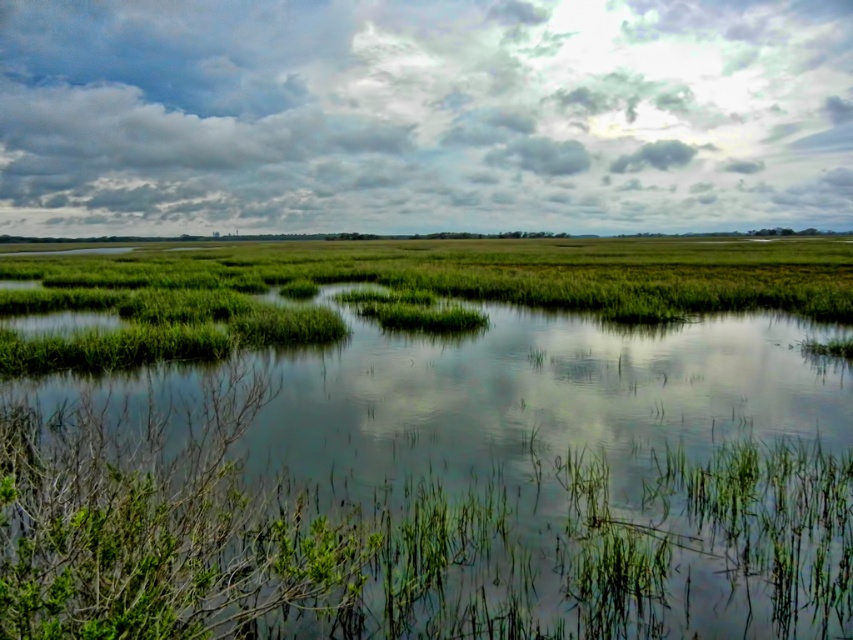
Is point (843, 22) closer to viewer compared to point (370, 502)?

No.

This screenshot has height=640, width=853. What do you see at coordinates (422, 115) in the screenshot?
I see `cloudy sky at upper center` at bounding box center [422, 115].

Locate an element on the screen. The height and width of the screenshot is (640, 853). cloudy sky at upper center is located at coordinates (422, 115).